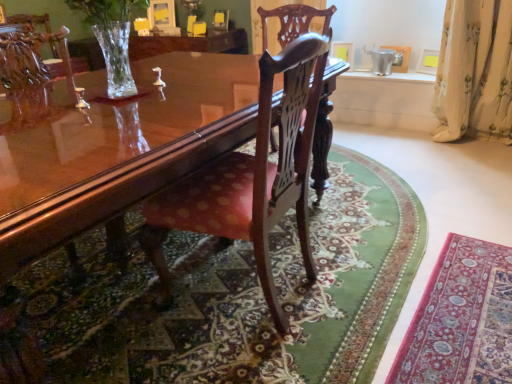
Measure the distance between point (435, 320) and camera.

They are 1.54 meters apart.

In order to face polished wood chair at center, the 2th chair in the front-to-back sequence, should I rotate leftwards or rightwards?

A 2.809 degree turn to the right will do.

In order to click on polished wood chair at center, the 1th chair from the front in this screenshot , I will do `click(253, 175)`.

The height and width of the screenshot is (384, 512). In order to click on glossy wood coffee table at center in this screenshot , I will do `click(115, 191)`.

At what (x,y) coordinates should I click in order to perform the action: click on velvet red rug at lower right. Please return your answer as a coordinate pair (x, y). Image resolution: width=512 pixels, height=384 pixels. Looking at the image, I should click on (461, 319).

At what (x,y) coordinates should I click in order to perform the action: click on mat below the polished wood chair at center, acting as the first chair starting from the back (from the image's perspective). Please return your answer as a coordinate pair (x, y). Looking at the image, I should click on click(461, 319).

Considering the sizes of objects polished wood chair at center, the 2th chair in the front-to-back sequence, and velvet red rug at lower right in the image provided, who is thinner, polished wood chair at center, the 2th chair in the front-to-back sequence, or velvet red rug at lower right?

Thinner between the two is velvet red rug at lower right.

Is polished wood chair at center, acting as the first chair starting from the back, far from velvet red rug at lower right?

No, polished wood chair at center, acting as the first chair starting from the back, is in close proximity to velvet red rug at lower right.

From a real-world perspective, which is physically below, polished wood chair at center, the 2th chair in the front-to-back sequence, or velvet red rug at lower right?

From a 3D spatial view, velvet red rug at lower right is below.

Is there a large distance between white floral fabric curtain at right and polished wood chair at center, the 2th chair in the front-to-back sequence?

Yes.

Considering the sizes of white floral fabric curtain at right and polished wood chair at center, the 2th chair in the front-to-back sequence, in the image, is white floral fabric curtain at right taller or shorter than polished wood chair at center, the 2th chair in the front-to-back sequence,?

Considering their sizes, white floral fabric curtain at right has less height than polished wood chair at center, the 2th chair in the front-to-back sequence.

From a real-world perspective, between white floral fabric curtain at right and polished wood chair at center, the 2th chair in the front-to-back sequence, who is vertically lower?

polished wood chair at center, the 2th chair in the front-to-back sequence, is physically lower.

Would you say velvet red rug at lower right is outside polished wood chair at center, the 2th chair from the back?

Yes, velvet red rug at lower right is located beyond the bounds of polished wood chair at center, the 2th chair from the back.

Which object is positioned more to the left, velvet red rug at lower right or polished wood chair at center, the 1th chair from the front?

polished wood chair at center, the 1th chair from the front, is more to the left.

From the image's perspective, is velvet red rug at lower right below polished wood chair at center, the 2th chair from the back?

Indeed, from the image's perspective, velvet red rug at lower right is shown beneath polished wood chair at center, the 2th chair from the back.

Would you say white floral fabric curtain at right is to the left or to the right of velvet red rug at lower right in the picture?

In the image, white floral fabric curtain at right appears on the right side of velvet red rug at lower right.

Is white floral fabric curtain at right inside the boundaries of velvet red rug at lower right, or outside?

white floral fabric curtain at right is not enclosed by velvet red rug at lower right.

Considering the sizes of objects white floral fabric curtain at right and velvet red rug at lower right in the image provided, who is taller, white floral fabric curtain at right or velvet red rug at lower right?

Standing taller between the two is white floral fabric curtain at right.

From the picture: From the image's perspective, would you say white floral fabric curtain at right is shown under velvet red rug at lower right?

Actually, white floral fabric curtain at right appears above velvet red rug at lower right in the image.

From a real-world perspective, is polished wood chair at center, the 1th chair from the front, physically located above or below glossy wood coffee table at center?

In terms of real-world spatial position, polished wood chair at center, the 1th chair from the front, is above glossy wood coffee table at center.

Is polished wood chair at center, the 1th chair from the front, inside the boundaries of glossy wood coffee table at center, or outside?

polished wood chair at center, the 1th chair from the front, fits inside glossy wood coffee table at center.

Which of these two, polished wood chair at center, the 1th chair from the front, or glossy wood coffee table at center, is bigger?

glossy wood coffee table at center.

Does polished wood chair at center, the 1th chair from the front, turn towards glossy wood coffee table at center?

Yes, polished wood chair at center, the 1th chair from the front, is oriented towards glossy wood coffee table at center.

Which of these two, polished wood chair at center, the 1th chair from the front, or white floral fabric curtain at right, stands shorter?

With less height is white floral fabric curtain at right.

From the image's perspective, which one is positioned higher, polished wood chair at center, the 2th chair from the back, or white floral fabric curtain at right?

white floral fabric curtain at right is shown above in the image.

Locate an element on the screen. curtain that is on the right side of polished wood chair at center, the 1th chair from the front is located at coordinates (475, 70).

Which object is wider, polished wood chair at center, the 2th chair from the back, or polished wood chair at center, acting as the first chair starting from the back?

polished wood chair at center, the 2th chair from the back, is wider.

From a real-world perspective, is polished wood chair at center, the 1th chair from the front, above or below polished wood chair at center, acting as the first chair starting from the back?

Clearly, from a real-world perspective, polished wood chair at center, the 1th chair from the front, is below polished wood chair at center, acting as the first chair starting from the back.

Does polished wood chair at center, the 2th chair from the back, lie in front of polished wood chair at center, the 2th chair in the front-to-back sequence?

Yes, it is in front of polished wood chair at center, the 2th chair in the front-to-back sequence.

From the image's perspective, which is below, polished wood chair at center, the 2th chair from the back, or polished wood chair at center, acting as the first chair starting from the back?

polished wood chair at center, the 2th chair from the back, is shown below in the image.

Locate an element on the screen. The height and width of the screenshot is (384, 512). mat on the right of polished wood chair at center, the 2th chair in the front-to-back sequence is located at coordinates (461, 319).

At what (x,y) coordinates should I click in order to perform the action: click on curtain that is above the polished wood chair at center, acting as the first chair starting from the back (from the image's perspective). Please return your answer as a coordinate pair (x, y). The height and width of the screenshot is (384, 512). Looking at the image, I should click on (475, 70).

Considering their positions, is glossy wood coffee table at center positioned closer to velvet red rug at lower right than polished wood chair at center, the 2th chair in the front-to-back sequence?

polished wood chair at center, the 2th chair in the front-to-back sequence, is closer to velvet red rug at lower right.

Based on their spatial positions, is glossy wood coffee table at center or polished wood chair at center, the 1th chair from the front, closer to velvet red rug at lower right?

polished wood chair at center, the 1th chair from the front.

Looking at this image, from the image, which object appears to be nearer to velvet red rug at lower right, polished wood chair at center, acting as the first chair starting from the back, or white floral fabric curtain at right?

The object closer to velvet red rug at lower right is polished wood chair at center, acting as the first chair starting from the back.

Looking at the image, which one is located closer to polished wood chair at center, the 1th chair from the front, glossy wood coffee table at center or velvet red rug at lower right?

Result: glossy wood coffee table at center is positioned closer to the anchor polished wood chair at center, the 1th chair from the front.

Which object lies nearer to the anchor point velvet red rug at lower right, polished wood chair at center, the 2th chair from the back, or glossy wood coffee table at center?

Among the two, polished wood chair at center, the 2th chair from the back, is located nearer to velvet red rug at lower right.

When comparing their distances from glossy wood coffee table at center, does white floral fabric curtain at right or polished wood chair at center, the 2th chair in the front-to-back sequence, seem closer?

polished wood chair at center, the 2th chair in the front-to-back sequence, is closer to glossy wood coffee table at center.

Considering their positions, is polished wood chair at center, acting as the first chair starting from the back, positioned closer to white floral fabric curtain at right than glossy wood coffee table at center?

polished wood chair at center, acting as the first chair starting from the back.

Considering their positions, is white floral fabric curtain at right positioned closer to velvet red rug at lower right than glossy wood coffee table at center?

Among the two, glossy wood coffee table at center is located nearer to velvet red rug at lower right.

I want to click on mat between glossy wood coffee table at center and polished wood chair at center, acting as the first chair starting from the back, in the front-back direction, so click(461, 319).

This screenshot has height=384, width=512. I want to click on mat between polished wood chair at center, the 2th chair in the front-to-back sequence, and white floral fabric curtain at right from left to right, so click(x=461, y=319).

The width and height of the screenshot is (512, 384). I want to click on chair located between polished wood chair at center, the 2th chair from the back, and white floral fabric curtain at right in the left-right direction, so click(294, 21).

This screenshot has height=384, width=512. I want to click on mat between glossy wood coffee table at center and white floral fabric curtain at right in the horizontal direction, so (x=461, y=319).